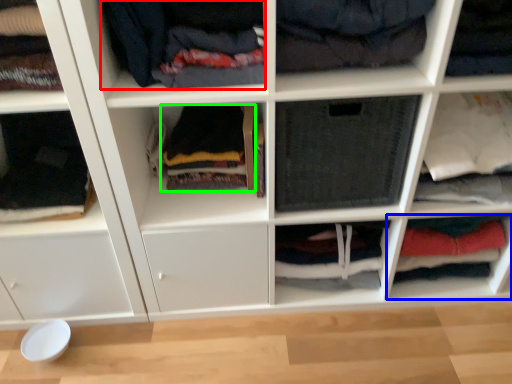
Question: Considering the real-world distances, which object is farthest from clothing (highlighted by a red box)? cabinet (highlighted by a blue box) or clothing (highlighted by a green box)?

Choices:
 (A) cabinet
 (B) clothing

Answer: (A)